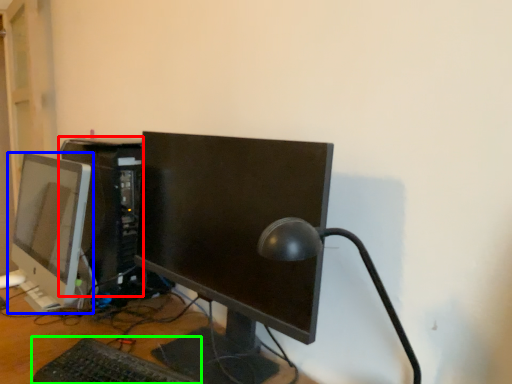
Question: Based on their relative distances, which object is farther from computer tower (highlighted by a red box)? Choose from computer monitor (highlighted by a blue box) and computer keyboard (highlighted by a green box).

Choices:
 (A) computer monitor
 (B) computer keyboard

Answer: (A)